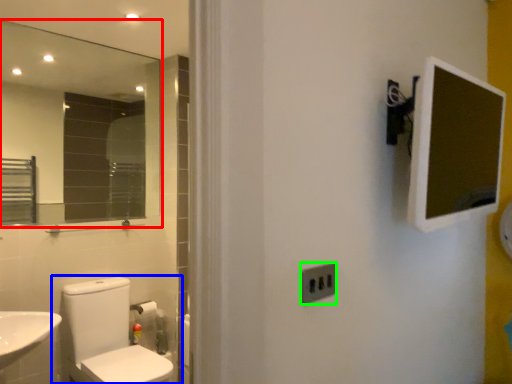
Question: Based on their relative distances, which object is farther from mirror (highlighted by a red box)? Choose from toilet (highlighted by a blue box) and electric outlet (highlighted by a green box).

Choices:
 (A) toilet
 (B) electric outlet

Answer: (B)